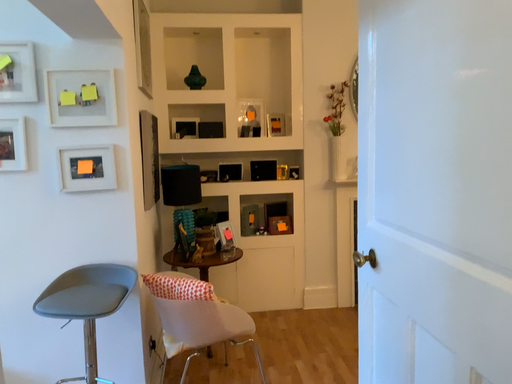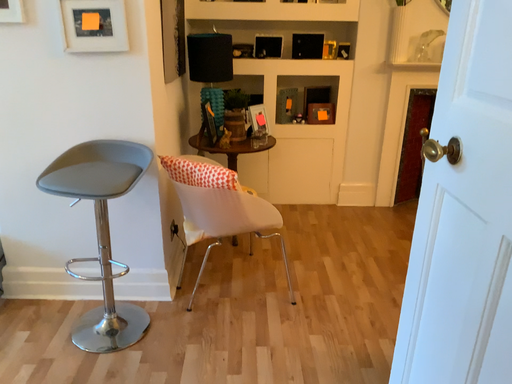
Question: Which way did the camera rotate in the video?

Choices:
 (A) rotated downward
 (B) rotated upward

Answer: (A)